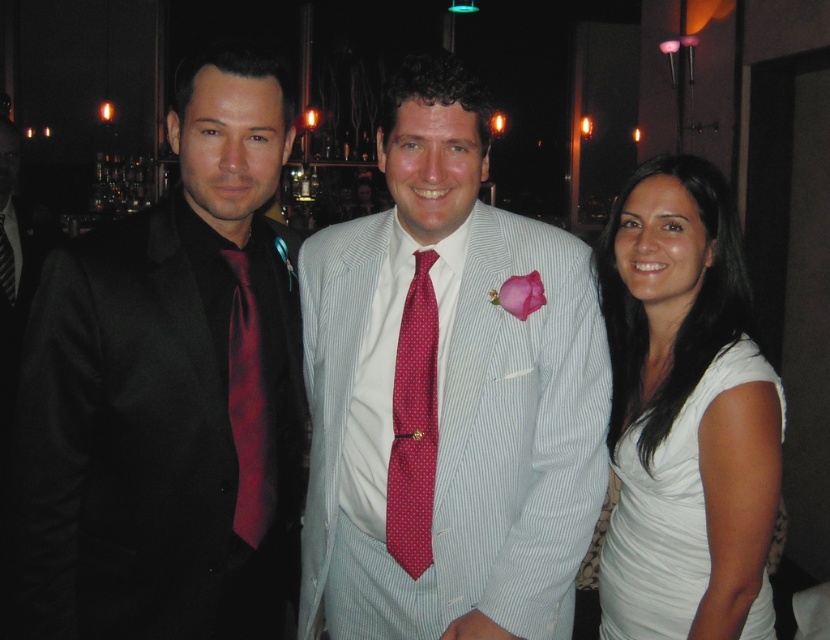
Does matte red tie at left have a lesser height compared to black silk tie at left?

No, matte red tie at left is not shorter than black silk tie at left.

Between matte red tie at left and black silk tie at left, which one has more height?

Standing taller between the two is matte red tie at left.

What do you see at coordinates (249, 408) in the screenshot? This screenshot has height=640, width=830. I see `matte red tie at left` at bounding box center [249, 408].

Locate an element on the screen. matte red tie at left is located at coordinates (249, 408).

Who is more distant from viewer, (394, 524) or (8, 269)?

Point (8, 269)

Between red dotted tie at center and black silk tie at left, which one is positioned higher?

black silk tie at left

The image size is (830, 640). I want to click on red dotted tie at center, so click(x=413, y=426).

Does matte black suit at left have a lesser width compared to matte red tie at left?

No, matte black suit at left is not thinner than matte red tie at left.

Between matte black suit at left and matte red tie at left, which one has more height?

Standing taller between the two is matte black suit at left.

Which is behind, point (100, 582) or point (262, 497)?

Point (262, 497)

Where is `matte black suit at left`? This screenshot has width=830, height=640. matte black suit at left is located at coordinates (168, 394).